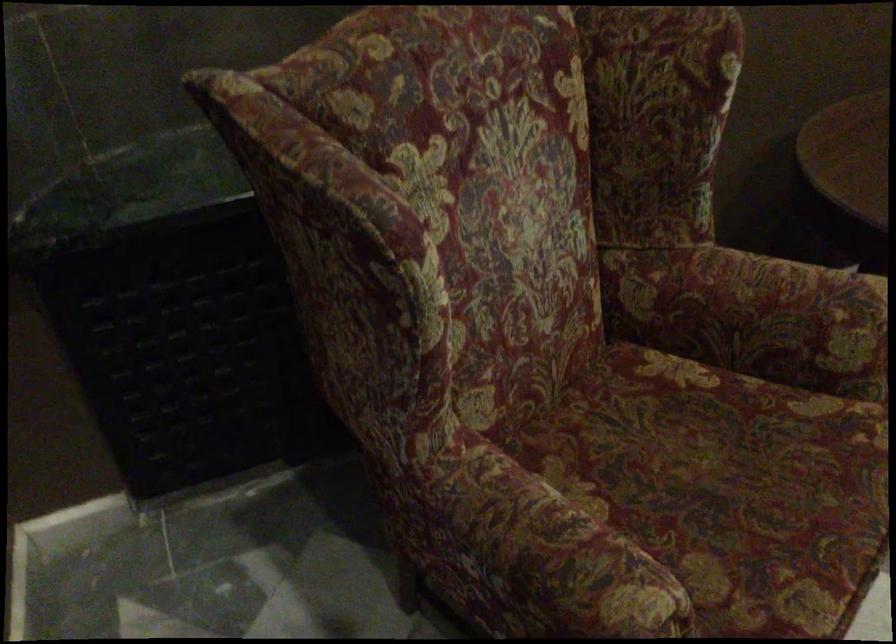
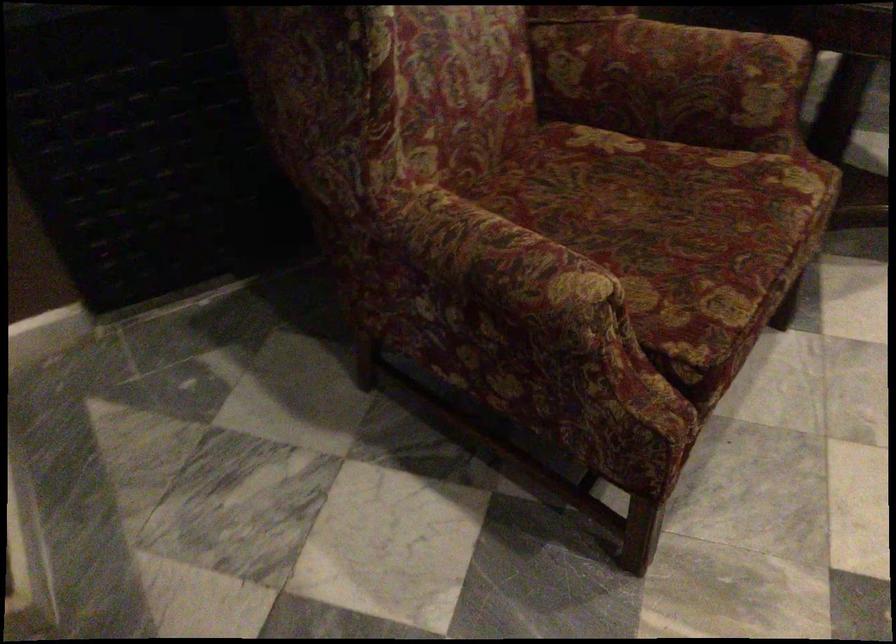
Question: How did the camera likely rotate?

Choices:
 (A) Left
 (B) Right
 (C) Up
 (D) Down

Answer: (D)